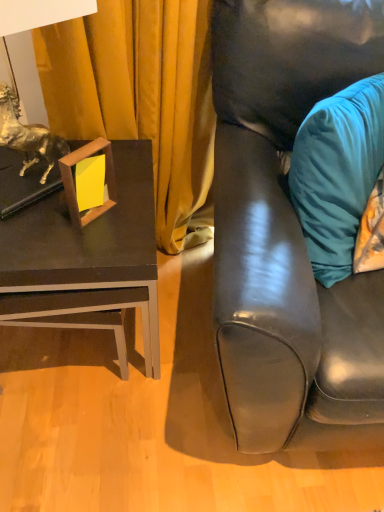
I want to click on free point in front of woodenobject at left, so click(x=86, y=248).